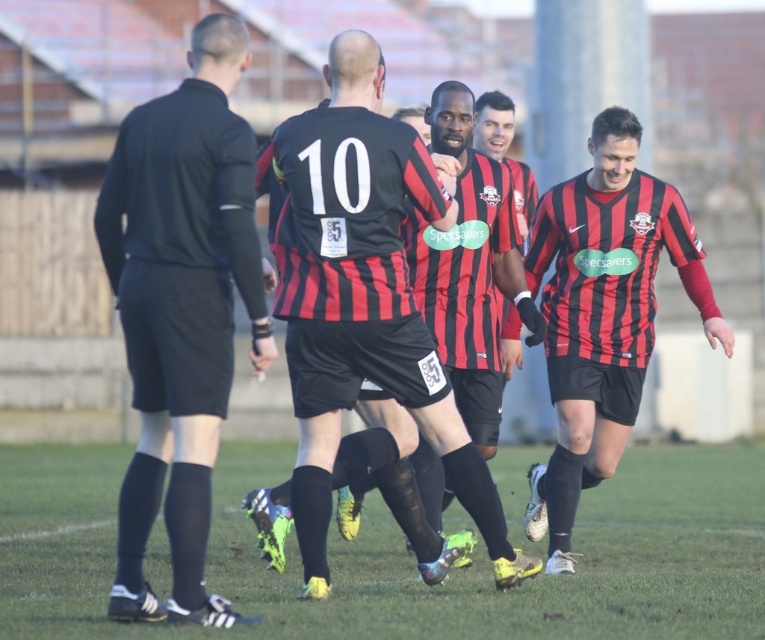
You are a GUI agent. You are given a task and a screenshot of the screen. Output one action in this format:
    pyautogui.click(x=<x>, y=<y>)
    Task: Click on the green grass at lower center
    
    Given the screenshot: What is the action you would take?
    pyautogui.click(x=404, y=556)

Does green grass at lower center appear on the right side of matte black soccer jersey at right?

No, green grass at lower center is not to the right of matte black soccer jersey at right.

Measure the distance between point (x=0, y=588) and camera.

Point (x=0, y=588) and camera are 10.40 meters apart.

Image resolution: width=765 pixels, height=640 pixels. Find the location of `green grass at lower center`. green grass at lower center is located at coordinates (404, 556).

What are the coordinates of `black matte referee at left` in the screenshot? It's located at 181,308.

Between black matte referee at left and matte black soccer jersey at right, which one appears on the right side from the viewer's perspective?

From the viewer's perspective, matte black soccer jersey at right appears more on the right side.

Who is more forward, (178, 208) or (578, 269)?

Point (178, 208) is more forward.

You are a GUI agent. You are given a task and a screenshot of the screen. Output one action in this format:
    pyautogui.click(x=<x>, y=<y>)
    Task: Click on the black matte referee at left
    The width and height of the screenshot is (765, 640).
    Given the screenshot: What is the action you would take?
    pyautogui.click(x=181, y=308)

Who is more distant from viewer, (405,584) or (226,401)?

The point (405,584) is behind.

Which is more to the left, green grass at lower center or black matte referee at left?

black matte referee at left

Looking at this image, measure the distance between green grass at lower center and camera.

The distance of green grass at lower center from camera is 8.29 meters.

Image resolution: width=765 pixels, height=640 pixels. Find the location of `green grass at lower center`. green grass at lower center is located at coordinates (404, 556).